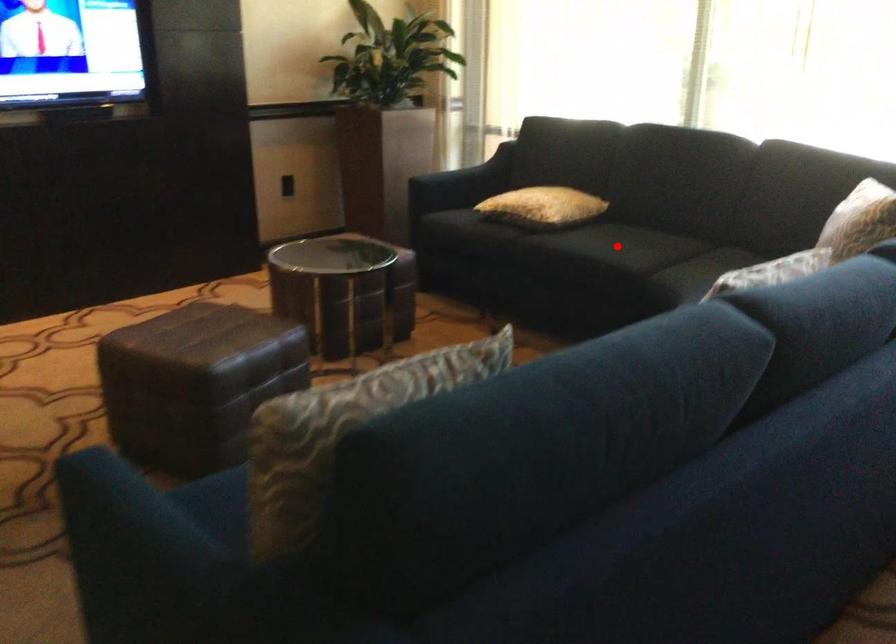
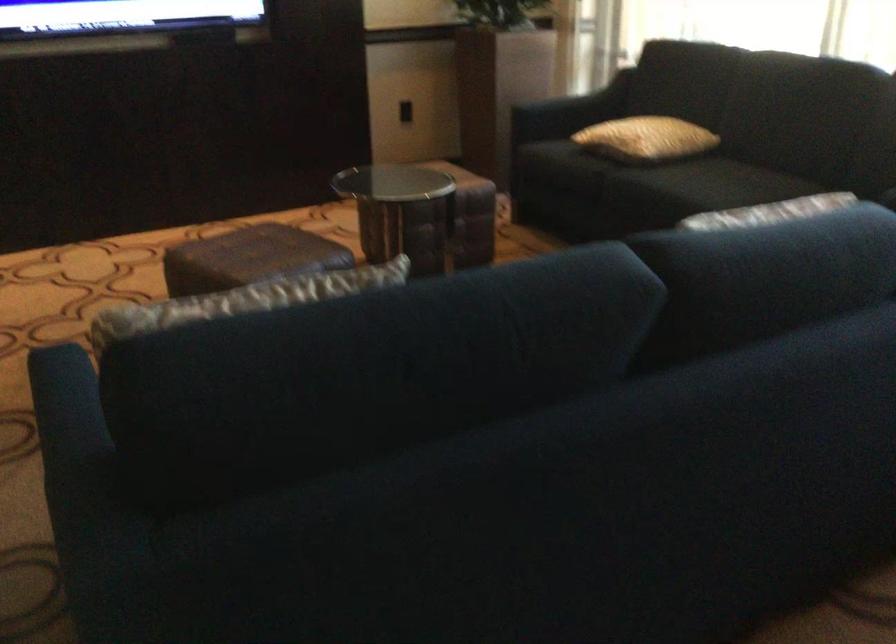
Where in the second image is the point corresponding to the highlighted location from the first image?

(709, 184)